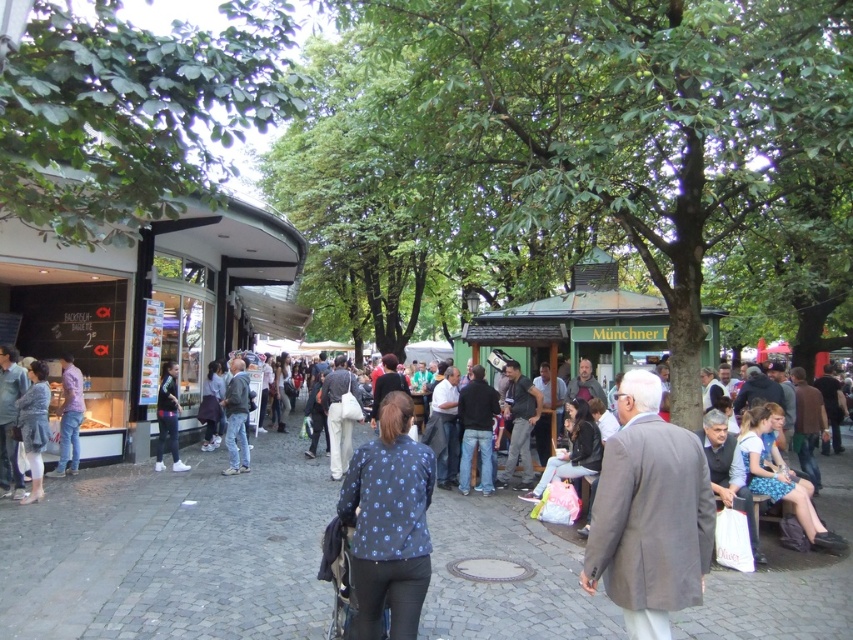
You are a street performer carrying a 1.2 meter wide box. You want to walk from the left side of the image to the right side. The paved stone pavement at center and the blue dotted jacket at center are in your path. Which object should you avoid to ensure the box fits through?

The paved stone pavement at center might be wider than blue dotted jacket at center, so you should avoid the blue dotted jacket at center to ensure the box fits through.